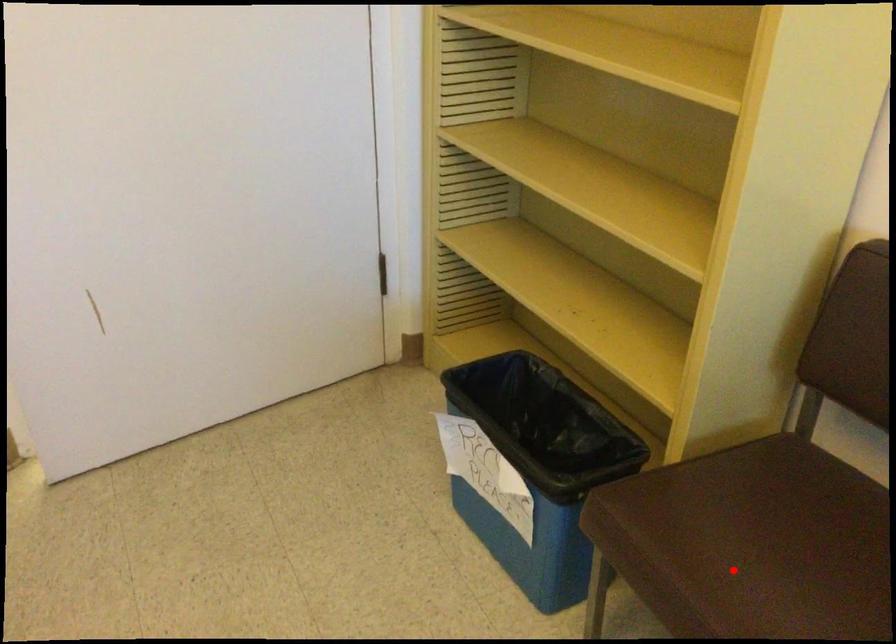
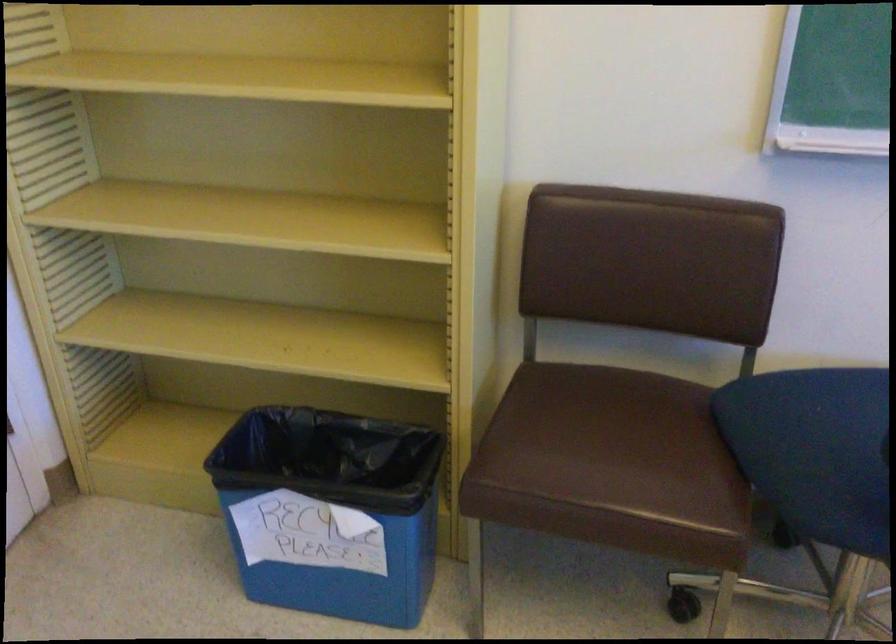
Question: I am providing you with two images of the same scene from different viewpoints. Given a red point in image1, look at the same physical point in image2. Is it:

Choices:
 (A) Closer to the viewpoint
 (B) Farther from the viewpoint

Answer: (B)